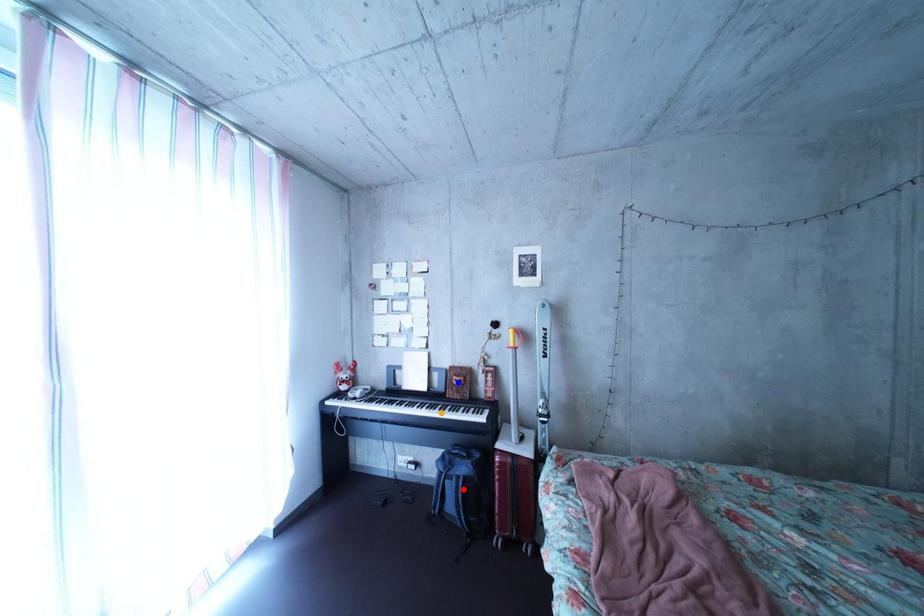
Order these from nearest to farthest:
blue point
orange point
red point

1. red point
2. blue point
3. orange point